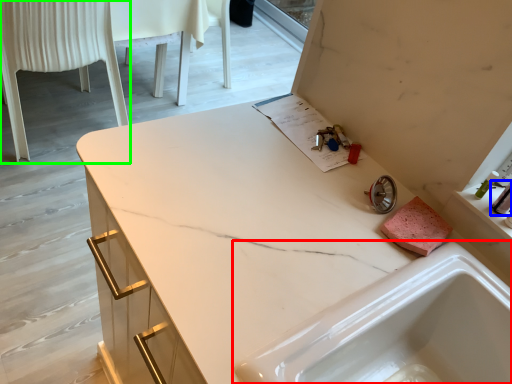
Question: Which object is the farthest from sink (highlighted by a red box)? Choose among these: toiletry (highlighted by a blue box) or chair (highlighted by a green box).

Choices:
 (A) toiletry
 (B) chair

Answer: (B)